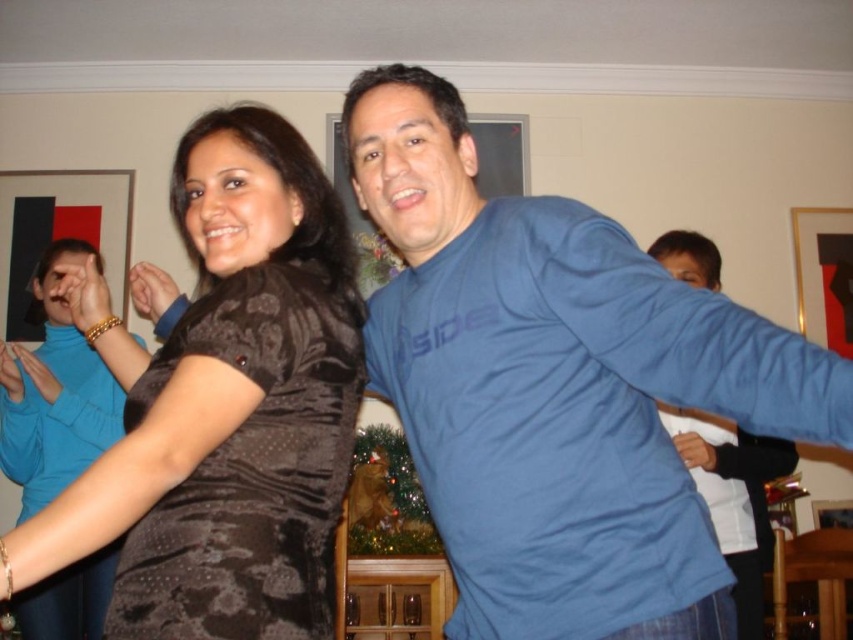
You are standing in the room and want to reach a point that is exactly at coordinates point (636, 392). If you can extend your arm 1 meter, can you touch that point?

The distance of point (636, 392) from viewer is 1.05 meters, so you cannot touch it with an arm extended 1 meter as it is slightly further away.

Based on the coordinates provided, can you identify which object corresponds to the point at (250, 467)?

The point at (250, 467) corresponds to the velvet brown dress at left.